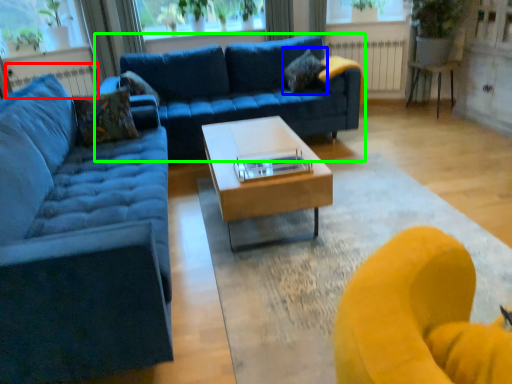
Question: Which is nearer to the radiator (highlighted by a red box)? pillow (highlighted by a blue box) or studio couch (highlighted by a green box).

Choices:
 (A) pillow
 (B) studio couch

Answer: (B)